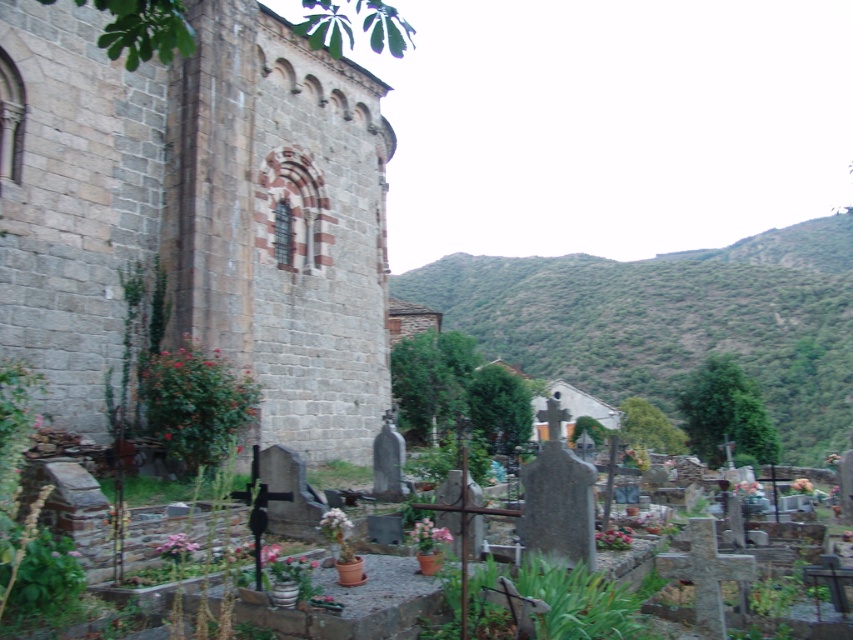
Can you confirm if gray stone church at center is taller than green leafy hillside at upper right?

No.

Can you confirm if gray stone church at center is positioned to the left of green leafy hillside at upper right?

Correct, you'll find gray stone church at center to the left of green leafy hillside at upper right.

Which is in front, point (373, 230) or point (659, 328)?

Positioned in front is point (373, 230).

At what (x,y) coordinates should I click in order to perform the action: click on gray stone church at center. Please return your answer as a coordinate pair (x, y). Looking at the image, I should click on (196, 216).